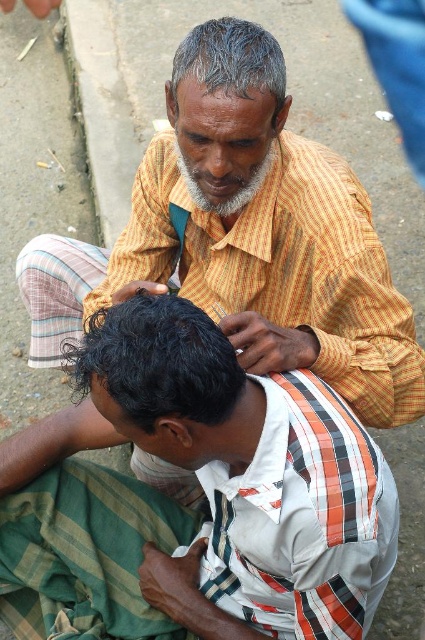
Does green striped cloth at lower left have a greater height compared to gray hair at upper center?

Indeed, green striped cloth at lower left has a greater height compared to gray hair at upper center.

Where is `green striped cloth at lower left`? This screenshot has height=640, width=425. green striped cloth at lower left is located at coordinates (87, 552).

At what (x,y) coordinates should I click in order to perform the action: click on green striped cloth at lower left. Please return your answer as a coordinate pair (x, y). This screenshot has height=640, width=425. Looking at the image, I should click on (87, 552).

How far apart are dark brown hair at lower left and gray hair at upper center?

dark brown hair at lower left is 25.00 inches from gray hair at upper center.

Between point (79, 369) and point (246, 44), which one is positioned in front?

Point (79, 369) is more forward.

This screenshot has width=425, height=640. What are the coordinates of `dark brown hair at lower left` in the screenshot? It's located at (158, 362).

This screenshot has width=425, height=640. I want to click on dark brown hair at lower left, so click(158, 362).

Between point (218, 344) and point (181, 58), which one is positioned behind?

Point (181, 58)

Does white striped shirt at lower center have a lesser height compared to gray hair at upper center?

In fact, white striped shirt at lower center may be taller than gray hair at upper center.

Identify the location of white striped shirt at lower center. Image resolution: width=425 pixels, height=640 pixels. 207,497.